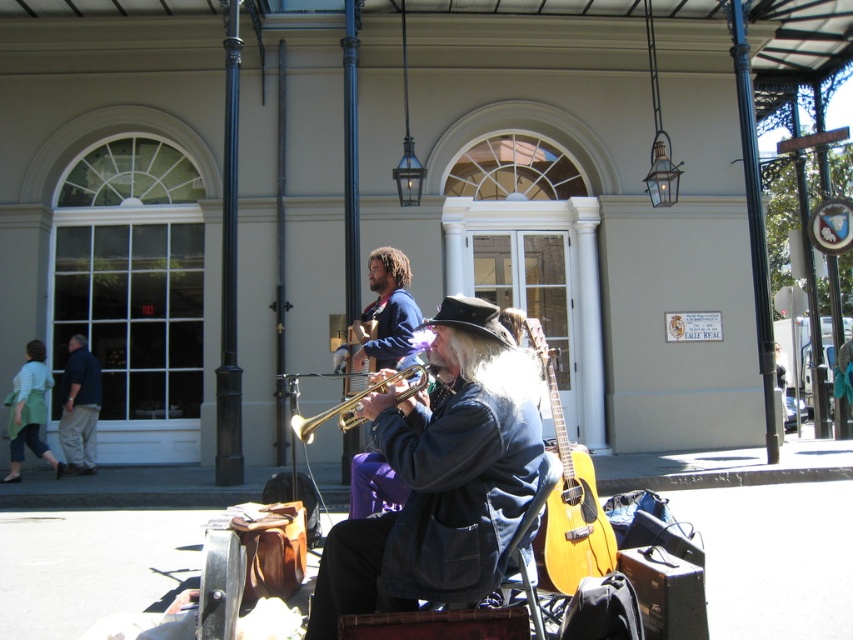
Who is positioned more to the right, denim jacket at center or acoustic wood guitar at center?

acoustic wood guitar at center is more to the right.

Is denim jacket at center wider than acoustic wood guitar at center?

Indeed, denim jacket at center has a greater width compared to acoustic wood guitar at center.

Locate an element on the screen. The image size is (853, 640). denim jacket at center is located at coordinates (442, 477).

Who is lower down, purple fabric pants at center or gold shiny trumpet at center?

Positioned lower is gold shiny trumpet at center.

Find the location of a particular element. Image resolution: width=853 pixels, height=640 pixels. purple fabric pants at center is located at coordinates (387, 312).

Where is `purple fabric pants at center`? The width and height of the screenshot is (853, 640). purple fabric pants at center is located at coordinates (387, 312).

Does purple fabric pants at center appear on the left side of dark blue shirt at left?

In fact, purple fabric pants at center is to the right of dark blue shirt at left.

Is purple fabric pants at center further to camera compared to dark blue shirt at left?

No, it is not.

Does point (354, 461) come behind point (79, 422)?

No, (354, 461) is closer to viewer.

Identify the location of purple fabric pants at center. (387, 312).